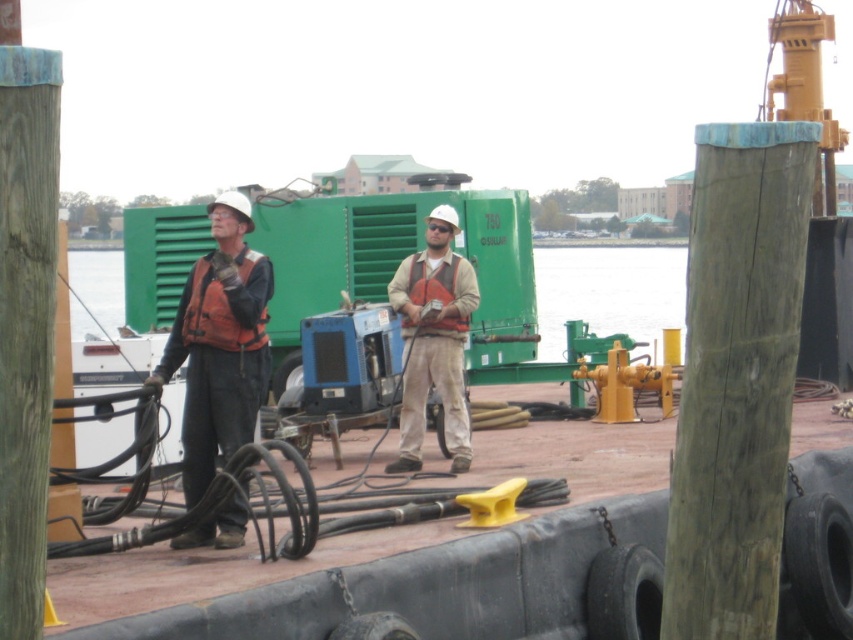
Can you confirm if orange life vest at center is positioned above matte orange vest at center?

Incorrect, orange life vest at center is not positioned above matte orange vest at center.

Does orange life vest at center have a larger size compared to matte orange vest at center?

Yes, orange life vest at center is bigger than matte orange vest at center.

Find the location of a particular element. orange life vest at center is located at coordinates (219, 344).